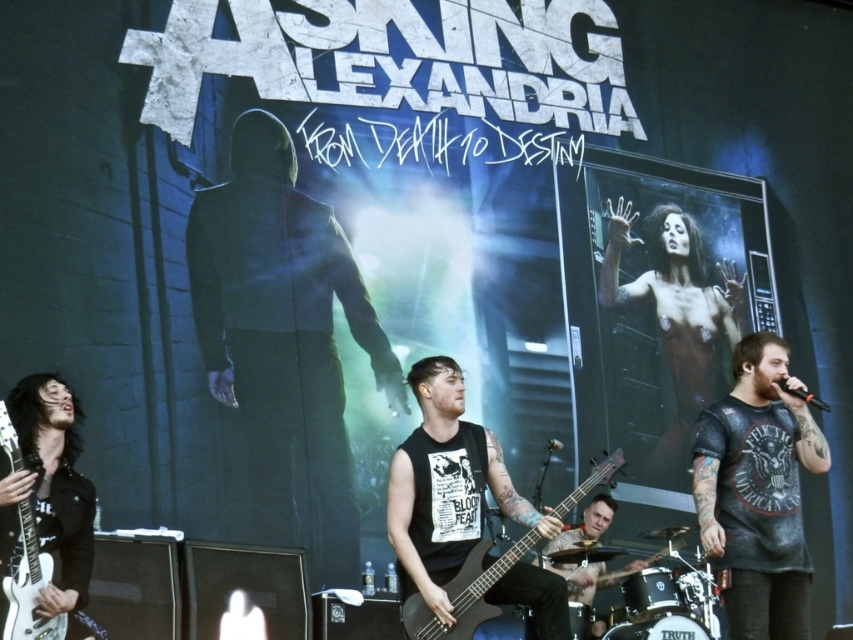
You are a photographer at the Asking Alexandria concert. You need to capture a photo that includes both the dark matte hoodie at center and the white glossy electric guitar at left. Based on their positions, which object should be placed on the left side of the photo to ensure both are visible?

The white glossy electric guitar at left should be placed on the left side of the photo because the dark matte hoodie at center is positioned on the right side of it, ensuring both are visible in the frame.